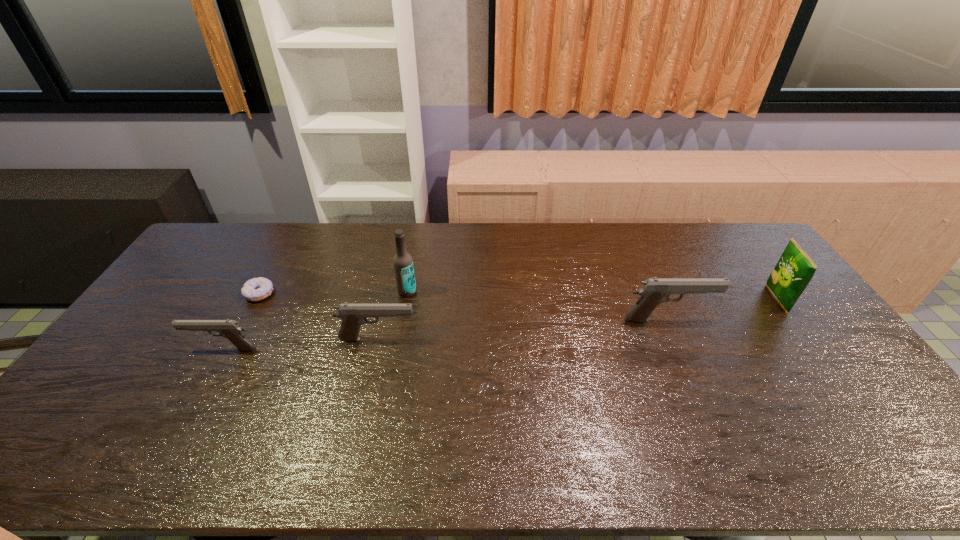
Please point a spot to place another pistol for symmetrical spacing. Please provide its 2D coordinates. Your answer should be formatted as a tuple, i.e. [(x, y)], where the tuple contains the x and y coordinates of a point satisfying the conditions above.

[(526, 329)]